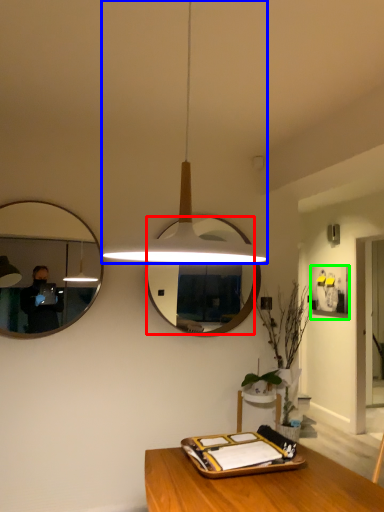
Question: Estimate the real-world distances between objects in this image. Which object is farther from mirror (highlighted by a red box), lamp (highlighted by a blue box) or picture frame (highlighted by a green box)?

Choices:
 (A) lamp
 (B) picture frame

Answer: (B)